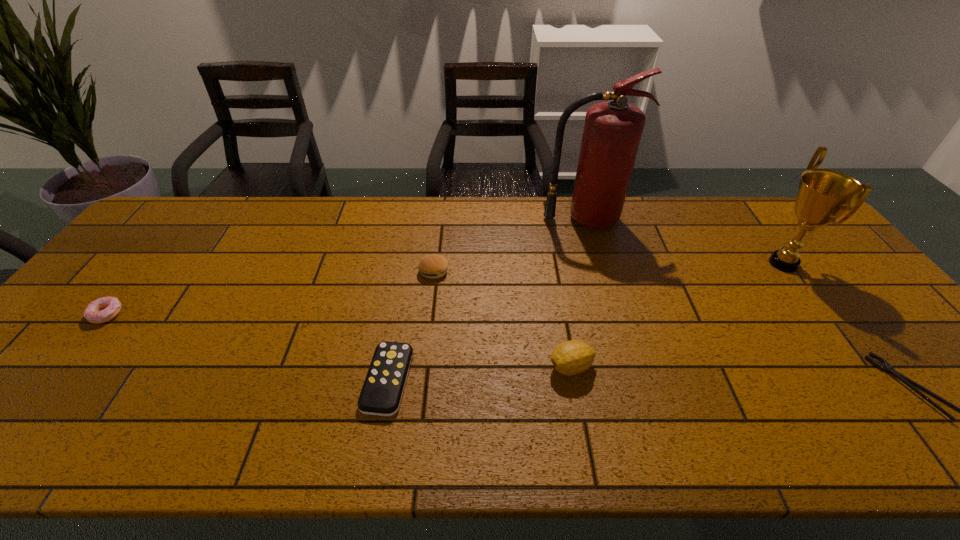
Where is `object that is at the left edge`? object that is at the left edge is located at coordinates (104, 309).

Identify the location of object that is at the right edge. (823, 195).

Where is `vacant space at the far edge`? vacant space at the far edge is located at coordinates (341, 238).

You are a GUI agent. You are given a task and a screenshot of the screen. Output one action in this format:
    pyautogui.click(x=<x>, y=<y>)
    Task: Click on the free location at the near edge of the desktop
    
    Given the screenshot: What is the action you would take?
    pyautogui.click(x=256, y=439)

This screenshot has height=540, width=960. In the image, there is a desktop. In order to click on vacant space at the left edge in this screenshot , I will do `click(128, 286)`.

In the image, there is a desktop. Identify the location of free space at the far left corner. tap(191, 220).

Identify the location of vacant region at the far right corner of the desktop. (792, 204).

At what (x,y) coordinates should I click in order to perform the action: click on vacant space that's between the lemon and the fire extinguisher. Please return your answer as a coordinate pair (x, y). Looking at the image, I should click on (578, 293).

Find the location of a particular element. The height and width of the screenshot is (540, 960). free space between the third tallest object and the patty is located at coordinates (502, 319).

The width and height of the screenshot is (960, 540). Find the location of `vacant area between the farthest object and the fifth tallest object`. vacant area between the farthest object and the fifth tallest object is located at coordinates (346, 266).